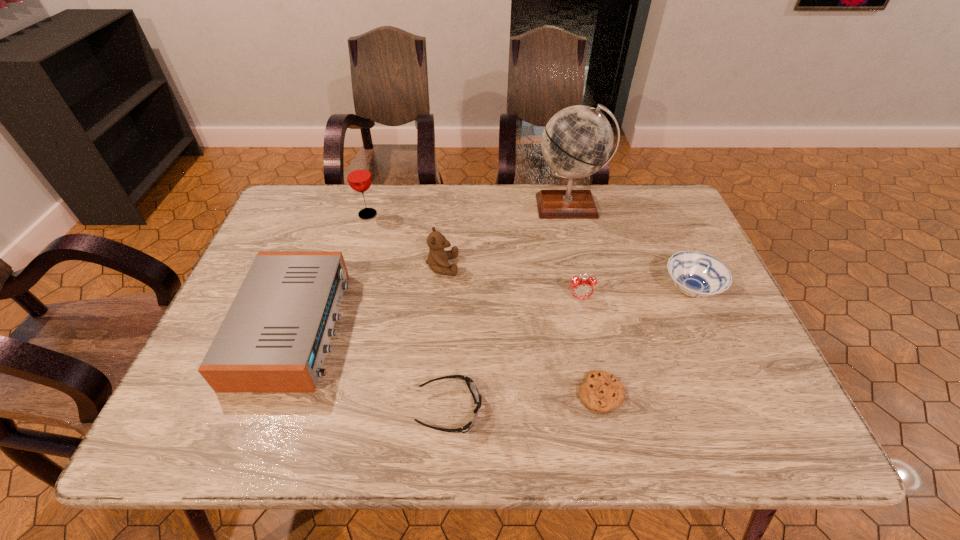
The image size is (960, 540). In the image, there is a desktop. In order to click on vacant region at the near right corner in this screenshot , I will do `click(762, 440)`.

Identify the location of free point between the alarm clock and the glass. (473, 256).

I want to click on vacant point located between the globe and the seventh tallest object, so click(509, 308).

You are a GUI agent. You are given a task and a screenshot of the screen. Output one action in this format:
    pyautogui.click(x=<x>, y=<y>)
    Task: Click on the free space between the third tallest object and the cookie
    The image size is (960, 540).
    Given the screenshot: What is the action you would take?
    pyautogui.click(x=521, y=330)

Where is `empty space between the sunglasses and the alarm clock`? The height and width of the screenshot is (540, 960). empty space between the sunglasses and the alarm clock is located at coordinates (515, 354).

Locate an element on the screen. free space between the rightmost object and the globe is located at coordinates (630, 248).

You are a GUI agent. You are given a task and a screenshot of the screen. Output one action in this format:
    pyautogui.click(x=<x>, y=<y>)
    Task: Click on the free space between the second tallest object and the teddy bear
    
    Given the screenshot: What is the action you would take?
    coord(405,240)

Where is `vacant area that lies between the radio receiver and the third tallest object`? The image size is (960, 540). vacant area that lies between the radio receiver and the third tallest object is located at coordinates (368, 296).

The height and width of the screenshot is (540, 960). I want to click on unoccupied area between the alarm clock and the sunglasses, so click(x=515, y=354).

Identify the location of empty space between the teddy bear and the sunglasses. click(x=445, y=338).